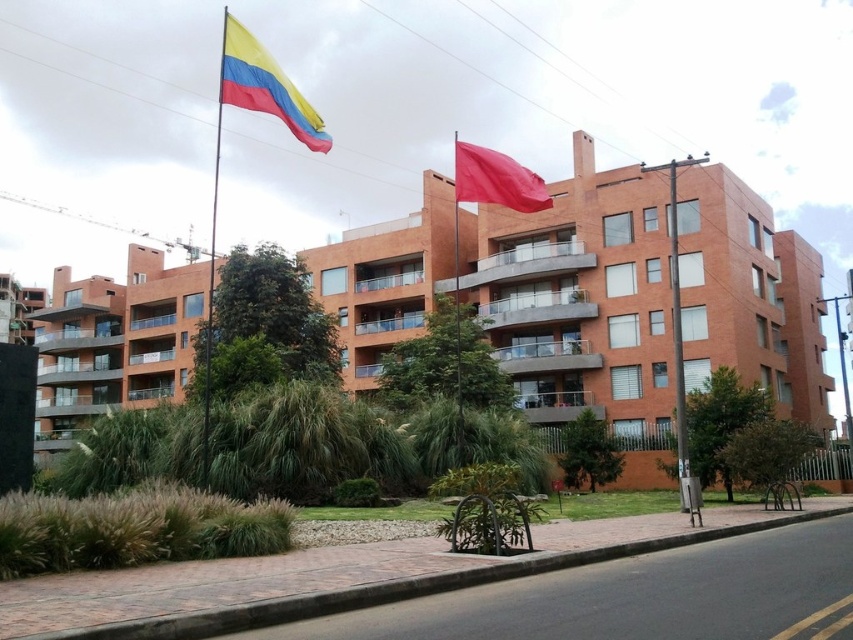
Question: Is yellow-red-blue fabric flag at upper left below metallic flag pole at upper left?

Choices:
 (A) no
 (B) yes

Answer: (A)

Question: Where is brick building at center located in relation to red matte flag at upper center in the image?

Choices:
 (A) left
 (B) right

Answer: (B)

Question: Which object is closer to the camera taking this photo?

Choices:
 (A) matte orange building at center
 (B) metallic flag pole at upper left
 (C) brick building at center
 (D) red matte flag at upper center

Answer: (B)

Question: Which object is farther from the camera taking this photo?

Choices:
 (A) brick building at center
 (B) metallic flag pole at upper left
 (C) matte orange building at center

Answer: (C)

Question: Does matte orange building at center lie in front of red matte flag at upper center?

Choices:
 (A) no
 (B) yes

Answer: (A)

Question: Which is nearer to the metallic gray pole at center?

Choices:
 (A) yellow-red-blue fabric flag at upper left
 (B) red matte flag at upper center

Answer: (B)